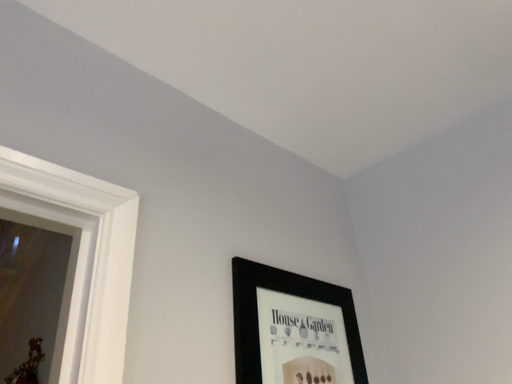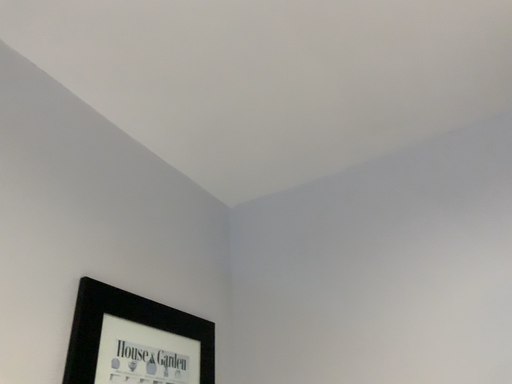
Question: How did the camera likely rotate when shooting the video?

Choices:
 (A) rotated right
 (B) rotated left

Answer: (A)